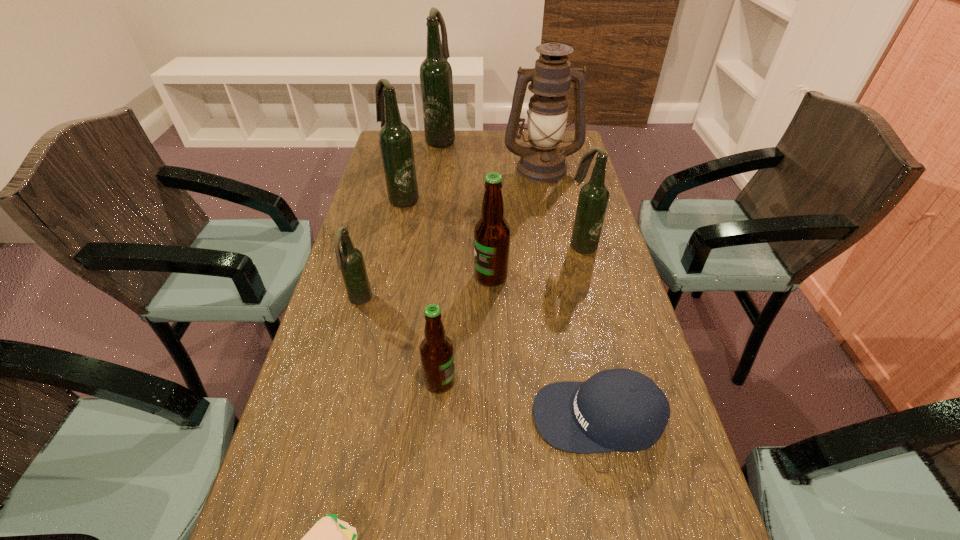
Locate an element on the screen. This screenshot has height=540, width=960. vacant space located on the label of the bigger brown beer bottle is located at coordinates (398, 276).

This screenshot has height=540, width=960. In order to click on free region located on the label of the bigger brown beer bottle in this screenshot , I will do `click(418, 276)`.

This screenshot has width=960, height=540. In order to click on free location located on the left of the second nearest dark beer bottle in this screenshot , I will do `click(466, 245)`.

You are a GUI agent. You are given a task and a screenshot of the screen. Output one action in this format:
    pyautogui.click(x=<x>, y=<y>)
    Task: Click on the free space located 0.220m on the label of the nearest beer bottle
    
    Given the screenshot: What is the action you would take?
    pyautogui.click(x=561, y=381)

Locate an element on the screen. blank space located on the front of the smallest dark beer bottle is located at coordinates (348, 346).

Find the location of a particular element. The height and width of the screenshot is (540, 960). blank area located on the front-facing side of the baseball cap is located at coordinates (482, 416).

Find the location of a particular element. The height and width of the screenshot is (540, 960). free point located on the front-facing side of the baseball cap is located at coordinates (477, 416).

Locate an element on the screen. Image resolution: width=960 pixels, height=540 pixels. vacant area located 0.190m on the front-facing side of the baseball cap is located at coordinates (437, 416).

Locate an element on the screen. beer bottle that is at the far edge is located at coordinates (x=436, y=79).

Locate an element on the screen. The image size is (960, 540). oil lamp that is at the far edge is located at coordinates (543, 161).